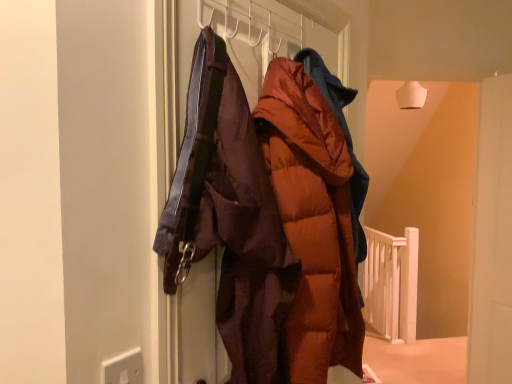
Where is `white plastic electric outlet at lower left`? The width and height of the screenshot is (512, 384). white plastic electric outlet at lower left is located at coordinates (123, 368).

Measure the distance between orange puffy coat at center and camera.

The depth of orange puffy coat at center is 37.83 inches.

I want to click on orange puffy coat at center, so click(x=313, y=221).

Identify the location of matte brown puffer jacket at center. (344, 137).

At what (x,y) coordinates should I click in order to perform the action: click on white plastic electric outlet at lower left. Please return your answer as a coordinate pair (x, y). Looking at the image, I should click on (123, 368).

Considering the sizes of white plastic electric outlet at lower left and matte brown puffer jacket at center in the image, is white plastic electric outlet at lower left bigger or smaller than matte brown puffer jacket at center?

Clearly, white plastic electric outlet at lower left is smaller in size than matte brown puffer jacket at center.

Considering the sizes of white plastic electric outlet at lower left and matte brown puffer jacket at center in the image, is white plastic electric outlet at lower left taller or shorter than matte brown puffer jacket at center?

Considering their sizes, white plastic electric outlet at lower left has less height than matte brown puffer jacket at center.

This screenshot has width=512, height=384. What are the coordinates of `electric outlet in front of the matte brown puffer jacket at center` in the screenshot? It's located at (123, 368).

Considering the positions of objects white plastic electric outlet at lower left and matte brown puffer jacket at center in the image provided, who is in front, white plastic electric outlet at lower left or matte brown puffer jacket at center?

Positioned in front is white plastic electric outlet at lower left.

The image size is (512, 384). I want to click on coat lying in front of the matte brown puffer jacket at center, so click(x=313, y=221).

Is matte brown puffer jacket at center far from orange puffy coat at center?

matte brown puffer jacket at center is actually quite close to orange puffy coat at center.

Is matte brown puffer jacket at center positioned with its back to orange puffy coat at center?

No, matte brown puffer jacket at center is not facing away from orange puffy coat at center.

How distant is matte brown puffer jacket at center from orange puffy coat at center?

A distance of 6.85 inches exists between matte brown puffer jacket at center and orange puffy coat at center.

Considering the sizes of objects white plastic electric outlet at lower left and orange puffy coat at center in the image provided, who is smaller, white plastic electric outlet at lower left or orange puffy coat at center?

white plastic electric outlet at lower left.

Could you tell me if white plastic electric outlet at lower left is facing orange puffy coat at center?

No, white plastic electric outlet at lower left is not facing towards orange puffy coat at center.

From the image's perspective, which is above, white plastic electric outlet at lower left or orange puffy coat at center?

orange puffy coat at center, from the image's perspective.

In the image, there is a orange puffy coat at center. What are the coordinates of `electric outlet below it (from the image's perspective)` in the screenshot? It's located at (123, 368).

Between white wooden rail at lower right and matte brown puffer jacket at center, which one has more height?

With more height is white wooden rail at lower right.

Can we say white wooden rail at lower right lies outside matte brown puffer jacket at center?

white wooden rail at lower right lies outside matte brown puffer jacket at center's area.

Is point (338, 164) positioned in front of point (379, 253)?

That is True.

Can you tell me how much orange puffy coat at center and white wooden rail at lower right differ in facing direction?

The angular difference between orange puffy coat at center and white wooden rail at lower right is 44.7 degrees.

Is there a large distance between orange puffy coat at center and white wooden rail at lower right?

Yes, orange puffy coat at center is far from white wooden rail at lower right.

Is matte brown puffer jacket at center to the left or to the right of white plastic electric outlet at lower left in the image?

Based on their positions, matte brown puffer jacket at center is located to the right of white plastic electric outlet at lower left.

In order to click on jacket located above the white plastic electric outlet at lower left (from a real-world perspective) in this screenshot , I will do `click(344, 137)`.

Could you tell me if matte brown puffer jacket at center is facing white plastic electric outlet at lower left?

No, matte brown puffer jacket at center is not aimed at white plastic electric outlet at lower left.

From a real-world perspective, who is located higher, orange puffy coat at center or matte brown puffer jacket at center?

matte brown puffer jacket at center is physically above.

Based on their sizes in the image, would you say orange puffy coat at center is bigger or smaller than matte brown puffer jacket at center?

orange puffy coat at center is bigger than matte brown puffer jacket at center.

Considering the points (276, 198) and (360, 193), which point is in front, point (276, 198) or point (360, 193)?

The point (276, 198) is in front.

Between orange puffy coat at center and matte brown puffer jacket at center, which one has more height?

With more height is orange puffy coat at center.

Image resolution: width=512 pixels, height=384 pixels. I want to click on electric outlet below the matte brown puffer jacket at center (from the image's perspective), so click(123, 368).

Locate an element on the screen. coat that appears in front of the matte brown puffer jacket at center is located at coordinates (313, 221).

Considering their positions, is white plastic electric outlet at lower left positioned closer to matte brown puffer jacket at center than orange puffy coat at center?

The object closer to matte brown puffer jacket at center is orange puffy coat at center.

Which object lies further to the anchor point white wooden rail at lower right, orange puffy coat at center or matte brown puffer jacket at center?

Among the two, orange puffy coat at center is located further to white wooden rail at lower right.

Estimate the real-world distances between objects in this image. Which object is further from orange puffy coat at center, white plastic electric outlet at lower left or white wooden rail at lower right?

white wooden rail at lower right.

Which object lies further to the anchor point matte brown puffer jacket at center, orange puffy coat at center or white wooden rail at lower right?

Based on the image, white wooden rail at lower right appears to be further to matte brown puffer jacket at center.

Estimate the real-world distances between objects in this image. Which object is further from orange puffy coat at center, white wooden rail at lower right or matte brown puffer jacket at center?

white wooden rail at lower right lies further to orange puffy coat at center than the other object.

Based on the photo, when comparing their distances from white plastic electric outlet at lower left, does orange puffy coat at center or white wooden rail at lower right seem further?

white wooden rail at lower right.

Based on their spatial positions, is matte brown puffer jacket at center or white plastic electric outlet at lower left closer to white wooden rail at lower right?

The object closer to white wooden rail at lower right is matte brown puffer jacket at center.

Estimate the real-world distances between objects in this image. Which object is further from white plastic electric outlet at lower left, white wooden rail at lower right or matte brown puffer jacket at center?

white wooden rail at lower right is positioned further to the anchor white plastic electric outlet at lower left.

Find the location of a particular element. jacket positioned between orange puffy coat at center and white wooden rail at lower right from near to far is located at coordinates (344, 137).

Locate an element on the screen. This screenshot has height=384, width=512. jacket located between white plastic electric outlet at lower left and white wooden rail at lower right in the depth direction is located at coordinates (344, 137).

Identify the location of coat between white plastic electric outlet at lower left and matte brown puffer jacket at center from left to right. (313, 221).

The width and height of the screenshot is (512, 384). What are the coordinates of `coat between white plastic electric outlet at lower left and white wooden rail at lower right in the front-back direction` in the screenshot? It's located at (313, 221).